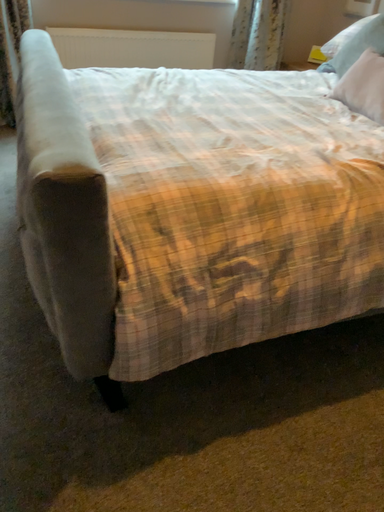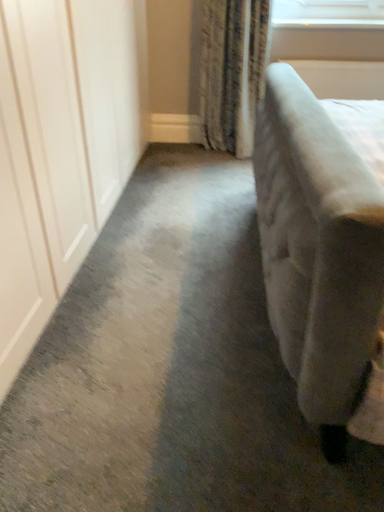
Question: Which way did the camera rotate in the video?

Choices:
 (A) rotated left
 (B) rotated right

Answer: (A)